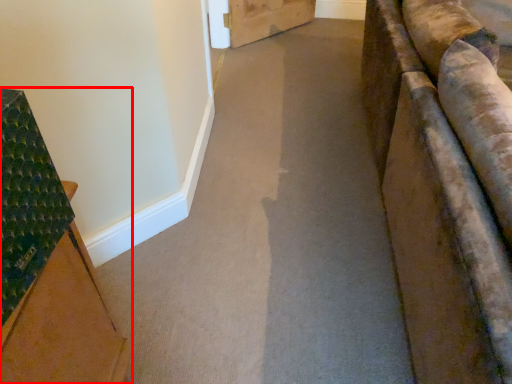
Question: From the image, what is the correct spatial relationship of furniture (annotated by the red box) in relation to path?

Choices:
 (A) right
 (B) left

Answer: (B)